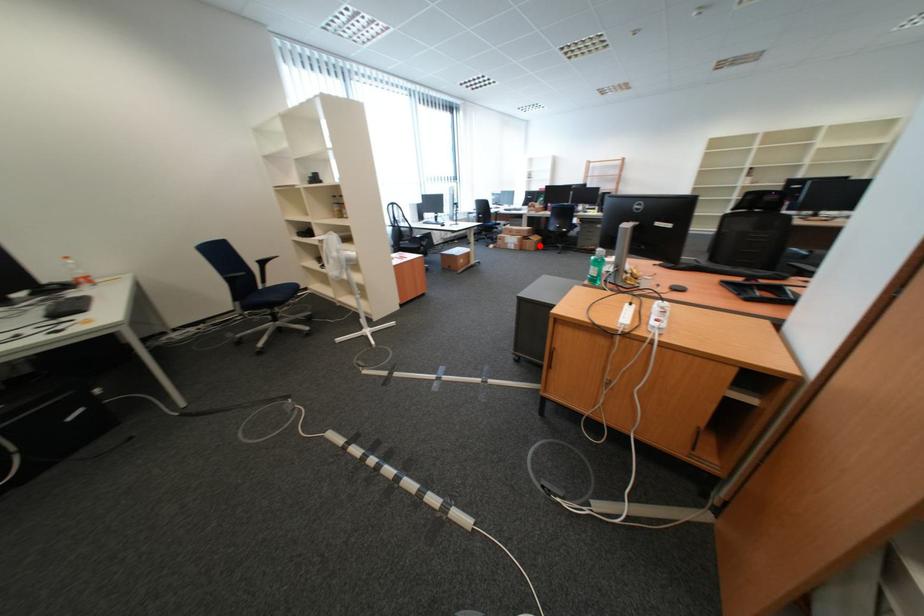
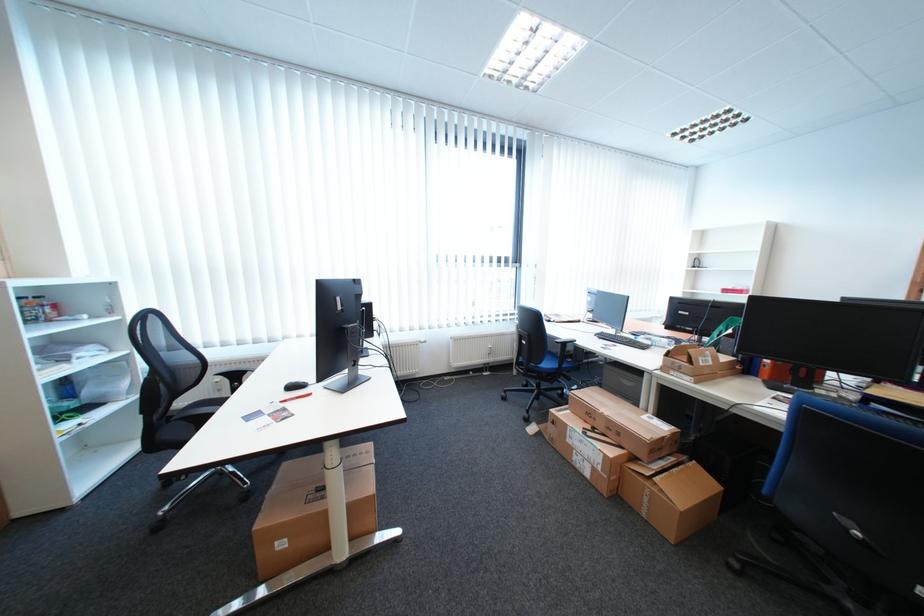
Question: I am providing you with two images of the same scene from different viewpoints. A red point is marked on the first image. Can you still see the location of the red point in image 2?

Choices:
 (A) Yes
 (B) No

Answer: (A)